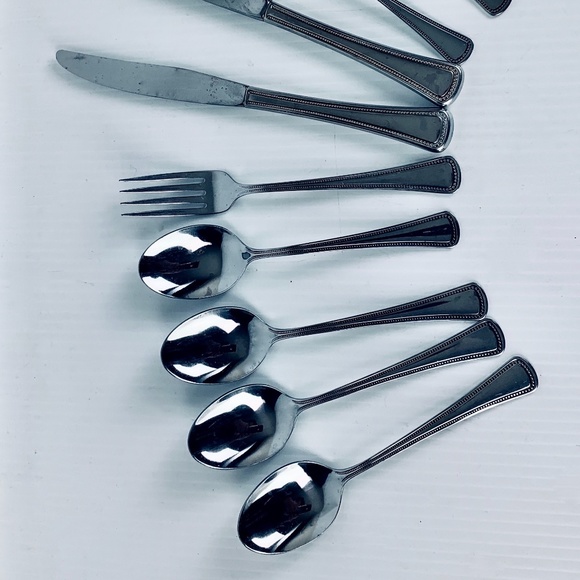
Where is `spoons`? spoons is located at coordinates (209, 262), (233, 350), (244, 438), (280, 516).